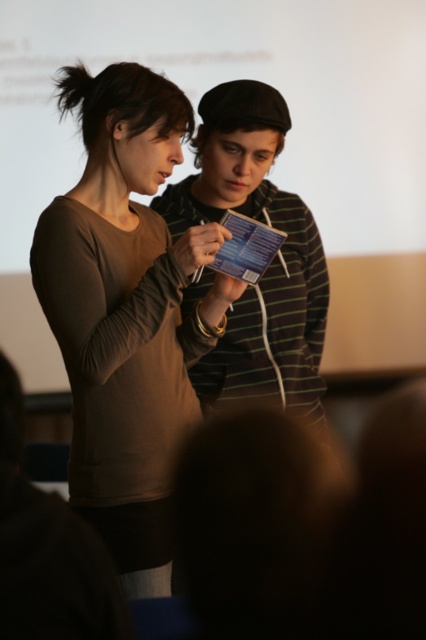
Question: Is matte brown shirt at center wider than striped cotton sweater at center?

Choices:
 (A) no
 (B) yes

Answer: (A)

Question: Is matte brown shirt at center further to camera compared to striped cotton sweater at center?

Choices:
 (A) yes
 (B) no

Answer: (B)

Question: Which point is closer to the camera?

Choices:
 (A) (89, 388)
 (B) (244, 113)

Answer: (A)

Question: Which of the following is the closest to the observer?

Choices:
 (A) (204, 120)
 (B) (144, 236)

Answer: (B)

Question: Can you confirm if matte brown shirt at center is positioned to the right of striped cotton sweater at center?

Choices:
 (A) yes
 (B) no

Answer: (B)